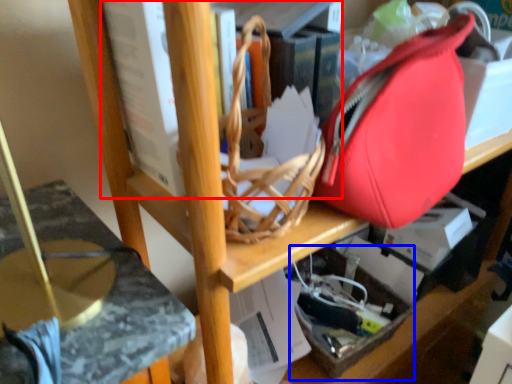
Question: Among these objects, which one is nearest to the camera, book (highlighted by a red box) or box (highlighted by a blue box)?

Choices:
 (A) book
 (B) box

Answer: (A)